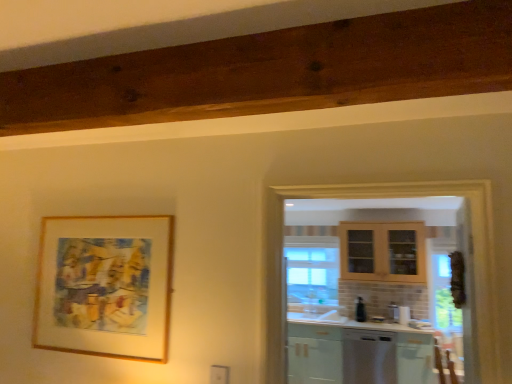
Question: Is matte white cabinet at lower right facing away from wooden frame at upper left?

Choices:
 (A) yes
 (B) no

Answer: (B)

Question: Does matte white cabinet at lower right appear on the left side of wooden frame at upper left?

Choices:
 (A) no
 (B) yes

Answer: (A)

Question: From a real-world perspective, is matte white cabinet at lower right on wooden frame at upper left?

Choices:
 (A) no
 (B) yes

Answer: (A)

Question: From the image's perspective, is matte white cabinet at lower right above wooden frame at upper left?

Choices:
 (A) no
 (B) yes

Answer: (A)

Question: Is matte white cabinet at lower right smaller than wooden frame at upper left?

Choices:
 (A) yes
 (B) no

Answer: (B)

Question: Does matte white cabinet at lower right have a larger size compared to wooden frame at upper left?

Choices:
 (A) yes
 (B) no

Answer: (A)

Question: Does matte white cabinet at lower right have a lesser width compared to satin white dishwasher at lower right?

Choices:
 (A) yes
 (B) no

Answer: (A)

Question: Is matte white cabinet at lower right positioned far away from satin white dishwasher at lower right?

Choices:
 (A) yes
 (B) no

Answer: (B)

Question: Is the position of matte white cabinet at lower right less distant than that of satin white dishwasher at lower right?

Choices:
 (A) no
 (B) yes

Answer: (B)

Question: Is matte white cabinet at lower right behind satin white dishwasher at lower right?

Choices:
 (A) yes
 (B) no

Answer: (B)

Question: From a real-world perspective, is matte white cabinet at lower right positioned under satin white dishwasher at lower right based on gravity?

Choices:
 (A) yes
 (B) no

Answer: (B)

Question: Is matte white cabinet at lower right shorter than satin white dishwasher at lower right?

Choices:
 (A) yes
 (B) no

Answer: (A)

Question: Is black glossy soap dispenser at center to the left of wooden frame at upper left from the viewer's perspective?

Choices:
 (A) no
 (B) yes

Answer: (A)